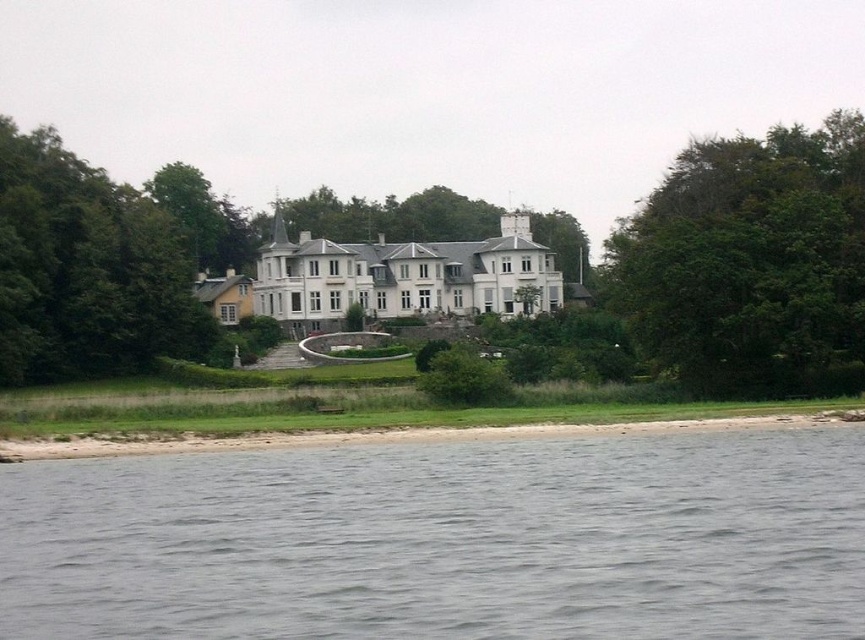
Question: Does green leafy tree at right have a larger size compared to white smooth mansion at center?

Choices:
 (A) yes
 (B) no

Answer: (A)

Question: Which object appears farthest from the camera in this image?

Choices:
 (A) smooth sand shoreline at lower center
 (B) white smooth mansion at center
 (C) green leafy tree at right
 (D) gray water at lower left

Answer: (B)

Question: Is white smooth mansion at center smaller than smooth sand shoreline at lower center?

Choices:
 (A) no
 (B) yes

Answer: (A)

Question: Which of the following is the closest to the observer?

Choices:
 (A) smooth sand shoreline at lower center
 (B) green leafy tree at left

Answer: (A)

Question: Which of the following is the closest to the observer?

Choices:
 (A) white smooth mansion at center
 (B) smooth sand shoreline at lower center
 (C) green leafy tree at left

Answer: (B)

Question: Is green leafy tree at right in front of smooth sand shoreline at lower center?

Choices:
 (A) yes
 (B) no

Answer: (B)